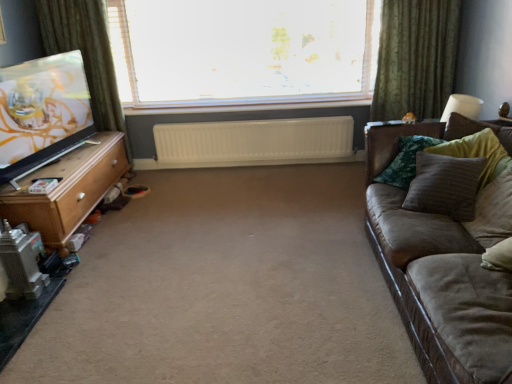
Question: Would you say suede brown couch at right is part of velvet green pillow at right, arranged as the 4th pillow when viewed from the front,'s contents?

Choices:
 (A) yes
 (B) no

Answer: (B)

Question: Is velvet green pillow at right, arranged as the 4th pillow when viewed from the front, located outside suede brown couch at right?

Choices:
 (A) yes
 (B) no

Answer: (B)

Question: Does velvet green pillow at right, arranged as the first pillow when viewed from the back, have a greater width compared to suede brown couch at right?

Choices:
 (A) no
 (B) yes

Answer: (A)

Question: Considering the relative sizes of velvet green pillow at right, arranged as the 4th pillow when viewed from the front, and suede brown couch at right in the image provided, is velvet green pillow at right, arranged as the 4th pillow when viewed from the front, smaller than suede brown couch at right?

Choices:
 (A) yes
 (B) no

Answer: (A)

Question: Does velvet green pillow at right, arranged as the 4th pillow when viewed from the front, have a lesser width compared to suede brown couch at right?

Choices:
 (A) no
 (B) yes

Answer: (B)

Question: Is velvet green pillow at right, arranged as the 4th pillow when viewed from the front, bigger than suede brown couch at right?

Choices:
 (A) yes
 (B) no

Answer: (B)

Question: From the image's perspective, is light brown wood tv stand at left beneath green fabric curtain at left, the first curtain in the left-to-right sequence?

Choices:
 (A) yes
 (B) no

Answer: (A)

Question: Is light brown wood tv stand at left at the right side of green fabric curtain at left, which is counted as the second curtain, starting from the right?

Choices:
 (A) no
 (B) yes

Answer: (B)

Question: From a real-world perspective, is light brown wood tv stand at left over green fabric curtain at left, the first curtain in the left-to-right sequence?

Choices:
 (A) no
 (B) yes

Answer: (A)

Question: Does light brown wood tv stand at left have a larger size compared to green fabric curtain at left, which is counted as the second curtain, starting from the right?

Choices:
 (A) yes
 (B) no

Answer: (A)

Question: Is light brown wood tv stand at left taller than green fabric curtain at left, which is counted as the second curtain, starting from the right?

Choices:
 (A) yes
 (B) no

Answer: (B)

Question: Can you confirm if light brown wood tv stand at left is thinner than green fabric curtain at left, which is counted as the second curtain, starting from the right?

Choices:
 (A) no
 (B) yes

Answer: (A)

Question: Are green fabric curtain at left, which is counted as the second curtain, starting from the right, and white plastic radiator at center beside each other?

Choices:
 (A) no
 (B) yes

Answer: (A)